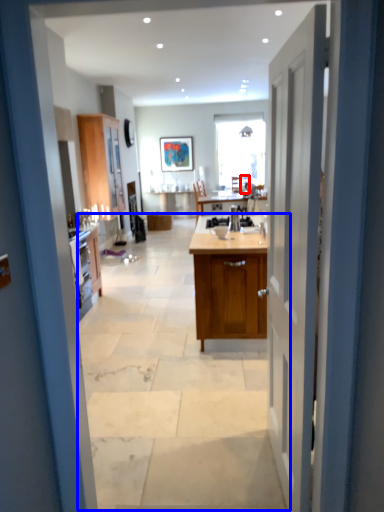
Question: Which object appears farthest to the camera in this image, chair (highlighted by a red box) or plain (highlighted by a blue box)?

Choices:
 (A) chair
 (B) plain

Answer: (A)